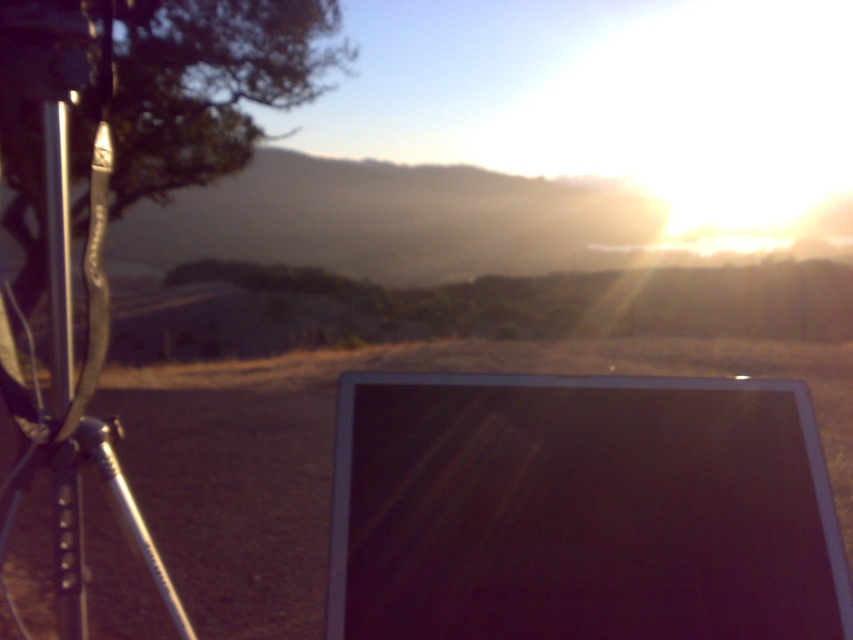
Question: Among these points, which one is nearest to the camera?

Choices:
 (A) (71, 308)
 (B) (73, 13)
 (C) (412, 353)

Answer: (B)

Question: Can you confirm if dirt field at lower center is positioned below silver metallic tripod at left?

Choices:
 (A) yes
 (B) no

Answer: (A)

Question: Which of the following is the closest to the observer?

Choices:
 (A) metallic silver pole at left
 (B) silver metallic tripod at left
 (C) dirt field at lower center

Answer: (C)

Question: Considering the real-world distances, which object is closest to the silver metallic tripod at left?

Choices:
 (A) metallic silver pole at left
 (B) dirt field at lower center

Answer: (A)

Question: Is silver metallic tripod at left smaller than metallic silver pole at left?

Choices:
 (A) no
 (B) yes

Answer: (A)

Question: Observing the image, what is the correct spatial positioning of dirt field at lower center in reference to metallic silver pole at left?

Choices:
 (A) right
 (B) left

Answer: (B)